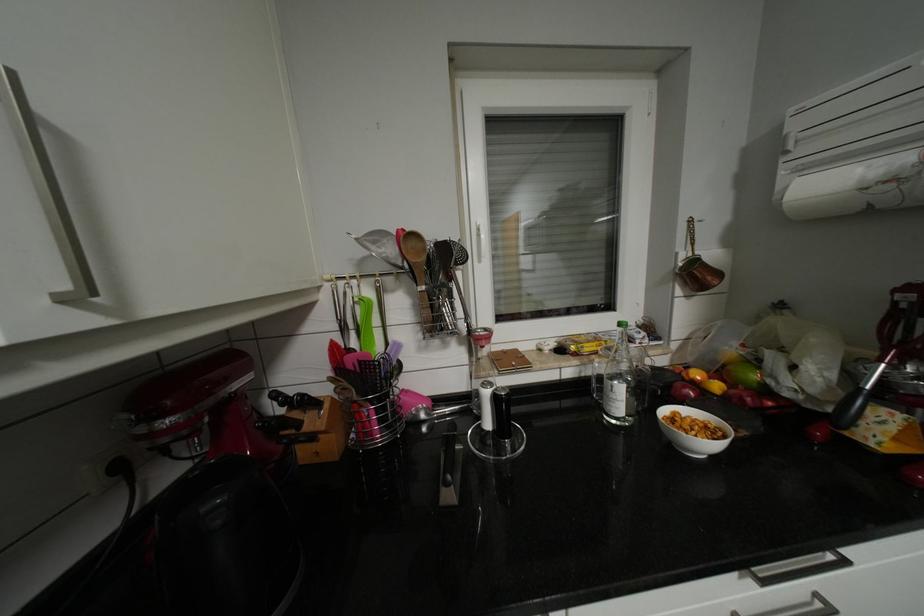
The image size is (924, 616). In order to click on white window handle in this screenshot , I will do `click(479, 238)`.